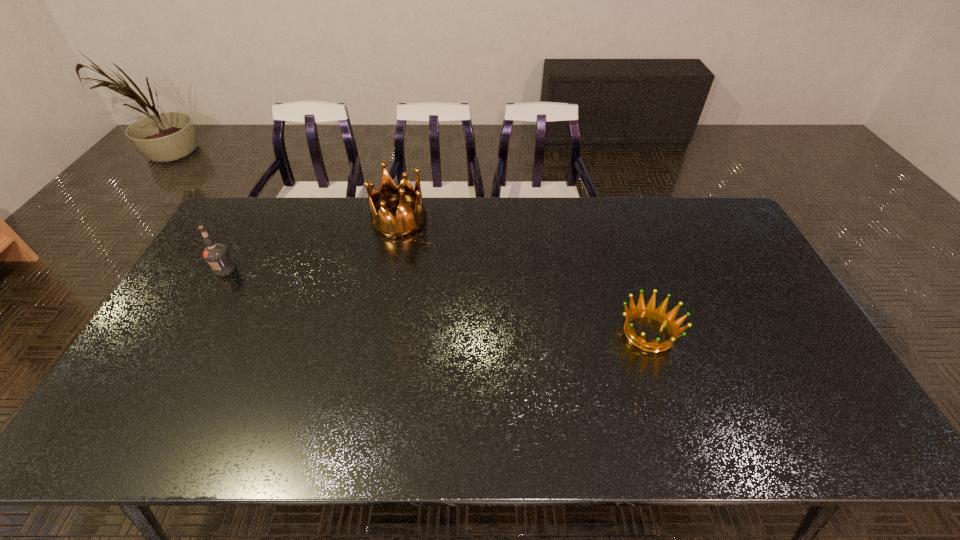
What are the coordinates of `the farthest object` in the screenshot? It's located at (407, 222).

In order to click on the taller crown in this screenshot , I will do coord(407,222).

Identify the location of vodka. (217, 256).

Identify the location of the leftmost object. (217, 256).

Identify the location of the rightmost object. The height and width of the screenshot is (540, 960). (659, 314).

At what (x,y) coordinates should I click in order to perform the action: click on the nearer crown. Please return your answer as a coordinate pair (x, y). Looking at the image, I should click on (659, 314).

This screenshot has height=540, width=960. Find the location of `vacant space located on the front of the farther crown`. vacant space located on the front of the farther crown is located at coordinates (393, 252).

Locate an element on the screen. Image resolution: width=960 pixels, height=540 pixels. free space located on the front label of the second nearest object is located at coordinates (191, 329).

In order to click on vacant space positioned 0.120m on the left of the nearest object in this screenshot , I will do `click(573, 333)`.

Where is `object that is at the far edge`? Image resolution: width=960 pixels, height=540 pixels. object that is at the far edge is located at coordinates (407, 222).